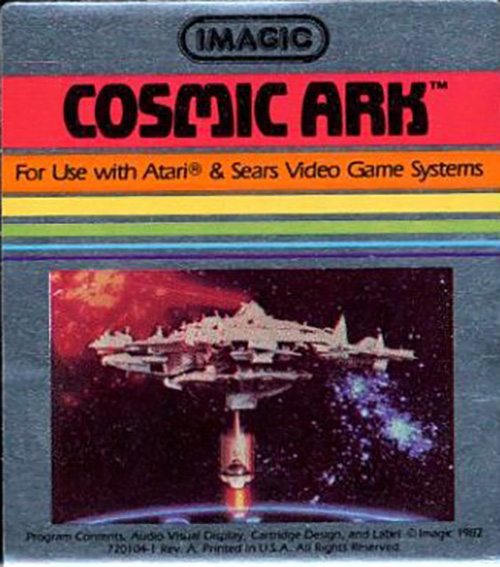
Identify the location of light. This screenshot has width=500, height=567. (234, 448).